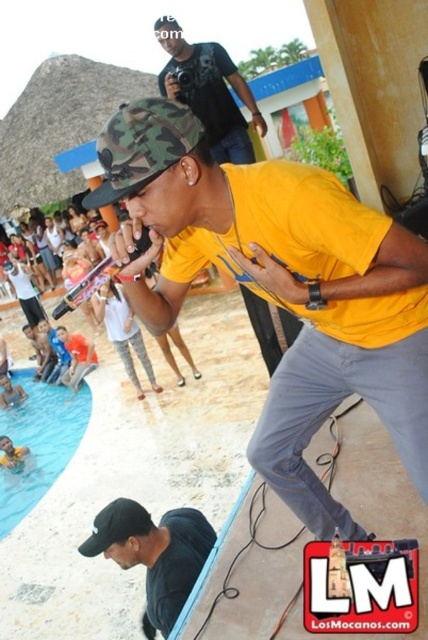
You are standing at the point labeled point (x=121, y=556) and want to move towards the point labeled point (x=32, y=500). Which direction should you move to get closer to your destination?

You should move downward and to the left to reach point (x=32, y=500) from point (x=121, y=556).

Consider the image. You are standing at the point labeled point (196, 68). You want to walk to the point labeled point (178, 541). Which direction should you face to walk straight towards your destination?

You should face towards the direction of the performer singing into the microphone because point (178, 541) is in front of point (196, 68).

You are standing at the point marked as point [38,442]. What is the surface you are standing on?

The point [38,442] is on blue smooth water at lower left, so you are standing on blue smooth water at lower left.